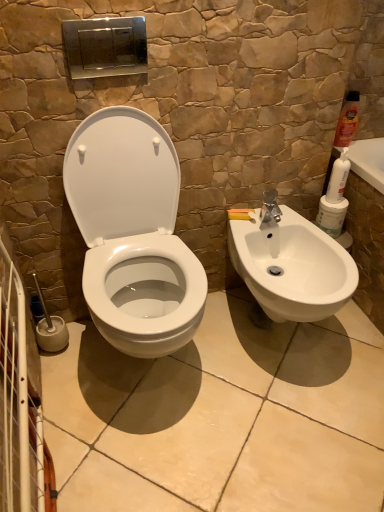
Question: Is matte orange bottle at upper right, the 1th cleaning product viewed from the right, positioned with its back to white matte cleaning product at right, the first cleaning product ordered from the bottom?

Choices:
 (A) no
 (B) yes

Answer: (A)

Question: Is matte orange bottle at upper right, the second cleaning product viewed from the left, closer to the viewer compared to white matte cleaning product at right, the 2th cleaning product viewed from the right?

Choices:
 (A) no
 (B) yes

Answer: (A)

Question: Can you confirm if matte orange bottle at upper right, the second cleaning product viewed from the left, is taller than white matte cleaning product at right, the 2th cleaning product viewed from the right?

Choices:
 (A) no
 (B) yes

Answer: (B)

Question: Is matte orange bottle at upper right, the second cleaning product viewed from the left, at the left side of white matte cleaning product at right, arranged as the first cleaning product when viewed from the left?

Choices:
 (A) no
 (B) yes

Answer: (A)

Question: Is matte orange bottle at upper right, the second cleaning product viewed from the left, beside white matte cleaning product at right, arranged as the first cleaning product when viewed from the left?

Choices:
 (A) no
 (B) yes

Answer: (A)

Question: Would you say matte orange bottle at upper right, the second cleaning product viewed from the left, is to the left or to the right of white matte cleaning product at right, arranged as the first cleaning product when viewed from the left, in the picture?

Choices:
 (A) right
 (B) left

Answer: (A)

Question: Is point (342, 121) closer or farther from the camera than point (344, 146)?

Choices:
 (A) closer
 (B) farther

Answer: (A)

Question: From a real-world perspective, is matte orange bottle at upper right, which is the first cleaning product from top to bottom, above or below white matte cleaning product at right, the 2th cleaning product viewed from the right?

Choices:
 (A) below
 (B) above

Answer: (B)

Question: From the image's perspective, is matte orange bottle at upper right, the 1th cleaning product viewed from the right, above or below white matte cleaning product at right, the 2th cleaning product viewed from the right?

Choices:
 (A) above
 (B) below

Answer: (A)

Question: Is white glossy toilet at center inside or outside of matte orange bottle at upper right, the 2th cleaning product when ordered from bottom to top?

Choices:
 (A) inside
 (B) outside

Answer: (B)

Question: From a real-world perspective, is white glossy toilet at center above or below matte orange bottle at upper right, the 2th cleaning product when ordered from bottom to top?

Choices:
 (A) below
 (B) above

Answer: (A)

Question: Looking at their shapes, would you say white glossy toilet at center is wider or thinner than matte orange bottle at upper right, the 2th cleaning product when ordered from bottom to top?

Choices:
 (A) wide
 (B) thin

Answer: (A)

Question: From the image's perspective, is white glossy toilet at center located above or below matte orange bottle at upper right, the second cleaning product viewed from the left?

Choices:
 (A) below
 (B) above

Answer: (A)

Question: Is point 145,186 positioned closer to the camera than point 326,197?

Choices:
 (A) closer
 (B) farther

Answer: (A)

Question: From the image's perspective, is white glossy toilet at center above or below white matte cleaning product at right, positioned as the 2th cleaning product in top-to-bottom order?

Choices:
 (A) above
 (B) below

Answer: (B)